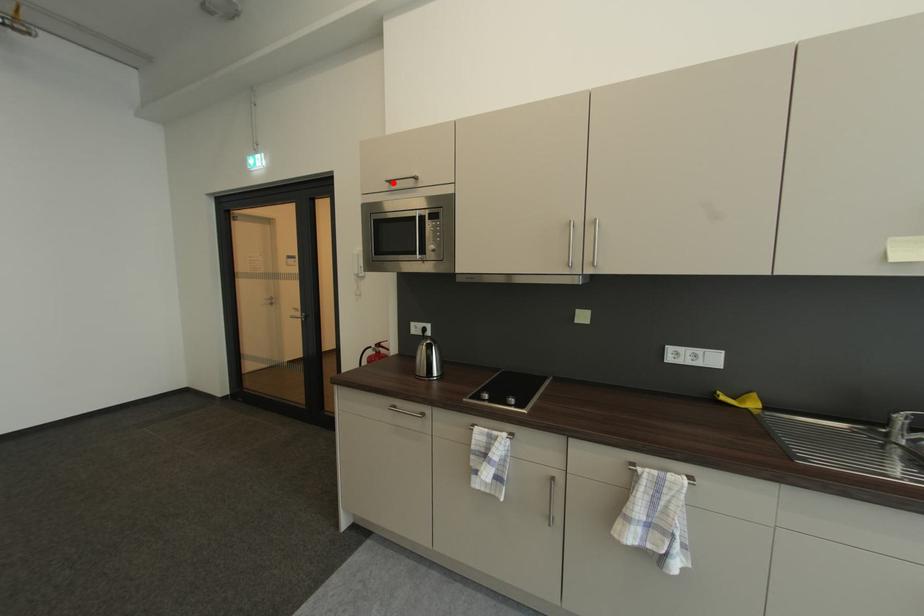
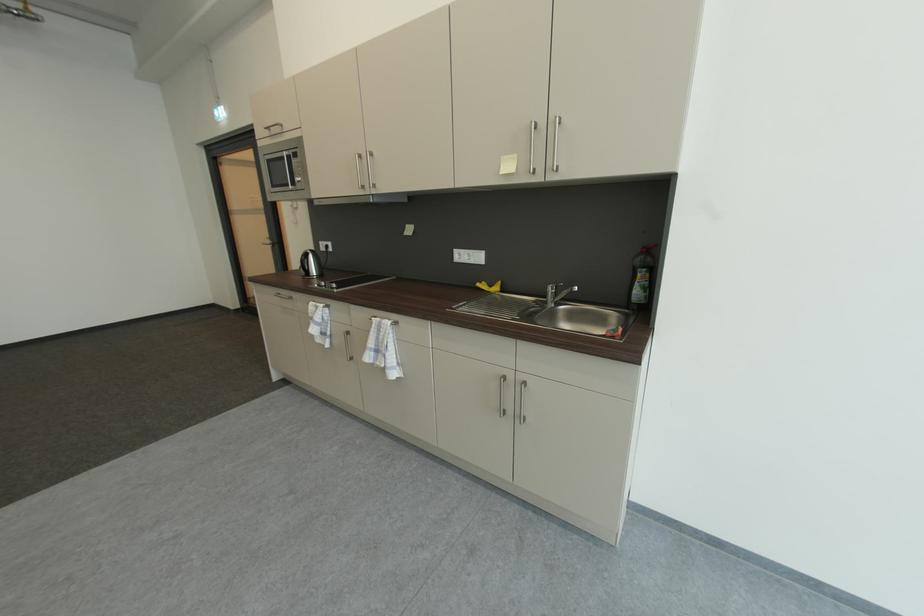
Question: I am providing you with two images of the same scene from different viewpoints. A red point is marked on the first image. At the location where the point appears in image 1, is it still visible in image 2?

Choices:
 (A) Yes
 (B) No

Answer: (A)